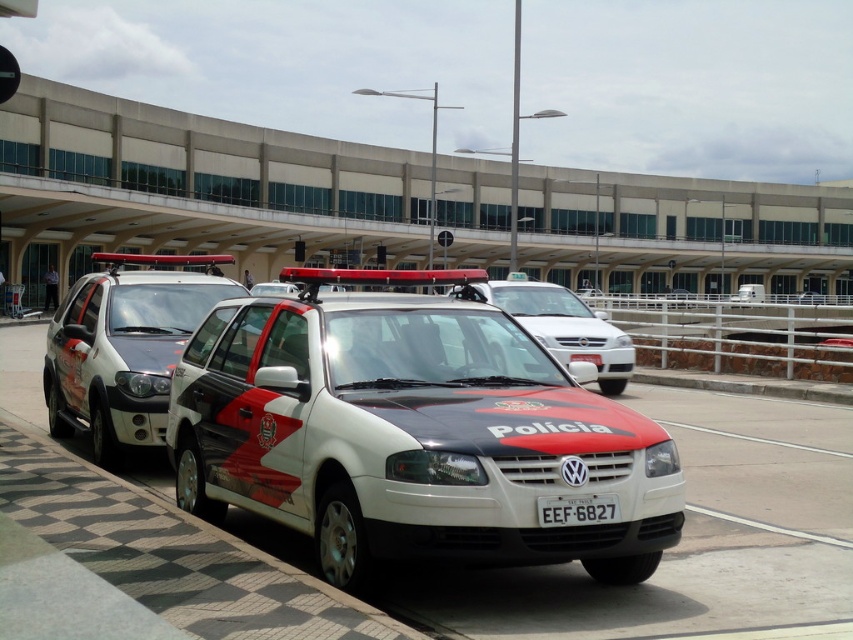
You are a security guard in the airport parking lot. You need to check the license plate of the white glossy police car at center. The camera you are using has a minimum focus distance of 15 feet. Can you clearly see the license plate from your current position?

The white glossy police car at center and camera are 14.27 feet apart from each other. Since the minimum focus distance is 15 feet, the camera cannot focus clearly at 14.27 feet. Therefore, you cannot clearly see the license plate from your current position.

You are a security guard at the airport. You need to direct a visitor to the white glossy police car at center and the white plastic license plate at center. Which one is positioned to the left?

The white glossy police car at center is positioned to the left of the white plastic license plate at center, so the police car is the one on the left side.

You are standing in the parking area of the airport terminal and see two points marked in the image. Which point, point [142,444] or point [509,289], is closer to you?

Point [142,444] is closer to the viewer than point [509,289].